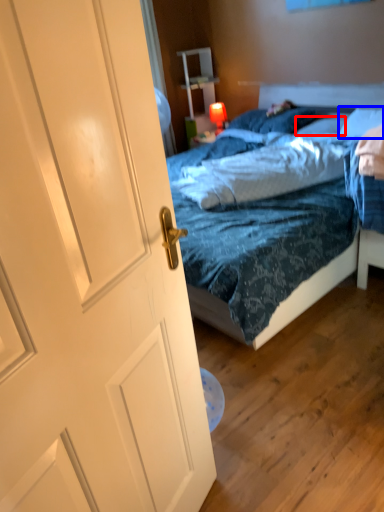
Question: Among these objects, which one is nearest to the camera, pillow (highlighted by a red box) or pillow (highlighted by a blue box)?

Choices:
 (A) pillow
 (B) pillow

Answer: (B)